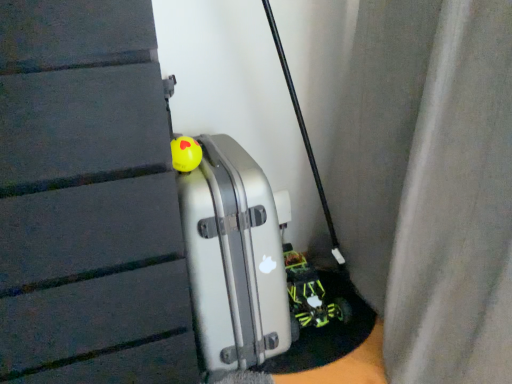
Question: Is silver metallic suitcase at center spatially inside neon green plastic toy car at lower right, or outside of it?

Choices:
 (A) outside
 (B) inside

Answer: (A)

Question: Is silver metallic suitcase at center taller or shorter than neon green plastic toy car at lower right?

Choices:
 (A) tall
 (B) short

Answer: (A)

Question: Which object is positioned closest to the neon green plastic toy car at lower right?

Choices:
 (A) yellow rubber ball at center
 (B) silver metallic suitcase at center

Answer: (B)

Question: Considering the real-world distances, which object is farthest from the yellow rubber ball at center?

Choices:
 (A) neon green plastic toy car at lower right
 (B) silver metallic suitcase at center

Answer: (A)